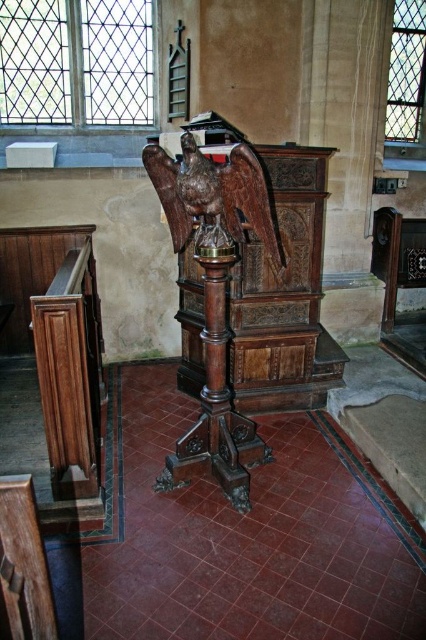
Is point (261, 205) farther from viewer compared to point (19, 616)?

Yes.

Between point (181, 189) and point (8, 529), which one is positioned in front?

Point (8, 529) is in front.

You are a GUI agent. You are given a task and a screenshot of the screen. Output one action in this format:
    pyautogui.click(x=<x>, y=<y>)
    Task: Click on the polished wood eagle at center
    This screenshot has height=640, width=426.
    Given the screenshot: What is the action you would take?
    pyautogui.click(x=213, y=195)